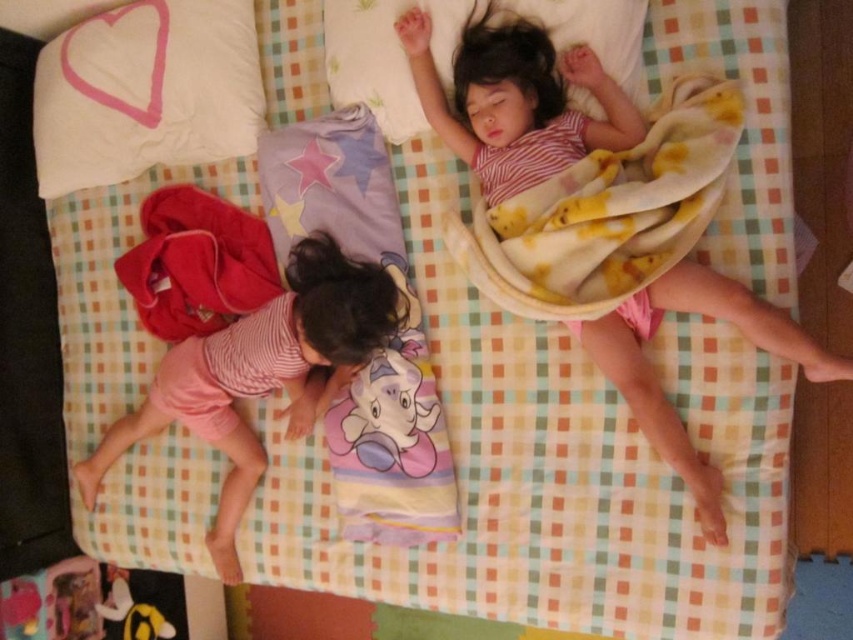
Consider the image. You are an interior designer analyzing the bed layout. The bed has a checkered pattern and two pillows. Where exactly is the pink striped shirt at lower left positioned on the bed?

The pink striped shirt at lower left is positioned at the 2D coordinates point [260,374] on the bed.

You are a parent trying to place the pastel pink plush elephant at center closer to the white soft pillow at upper center so your child can reach it easily. Given that the distance between them is 21.19 inches, is this distance considered within a comfortable reach for a child lying on the bed?

The distance between the white soft pillow at upper center and the pastel pink plush elephant at center is 21.19 inches. A comfortable reach for a child lying on the bed is typically around 18 to 24 inches, so this distance falls within the comfortable range. The child can easily reach the pastel pink plush elephant at center from the white soft pillow at upper center.

You are a parent trying to place a small nightlight on the bed. The nightlight requires a flat surface that is at least as tall as the pastel pink plush elephant at center. Can you place it on the white soft pillow at upper center?

The white soft pillow at upper center has a greater height compared to the pastel pink plush elephant at center, so yes, the nightlight can be placed on the white soft pillow at upper center since its height meets the requirement.